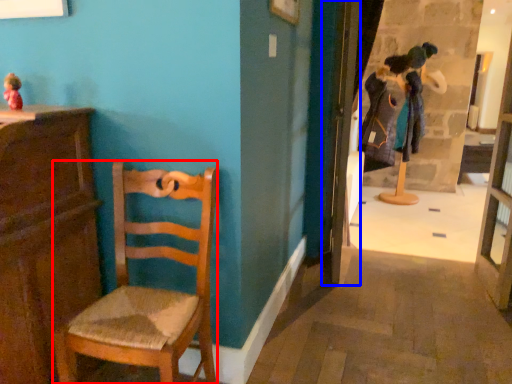
Question: Among these objects, which one is farthest to the camera, chair (highlighted by a red box) or door (highlighted by a blue box)?

Choices:
 (A) chair
 (B) door

Answer: (B)